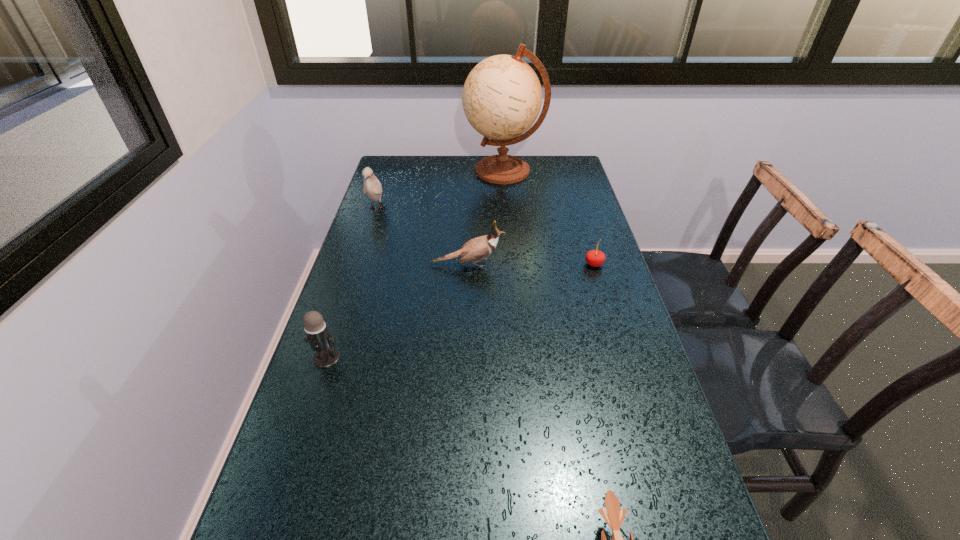
You are a GUI agent. You are given a task and a screenshot of the screen. Output one action in this format:
    pyautogui.click(x=<x>, y=<y>)
    Task: Click on the farthest object
    
    Given the screenshot: What is the action you would take?
    pyautogui.click(x=502, y=96)

Identify the location of the tallest object. point(502,96).

Where is `the leftmost bird`? The height and width of the screenshot is (540, 960). the leftmost bird is located at coordinates (372, 187).

You are a GUI agent. You are given a task and a screenshot of the screen. Output one action in this format:
    pyautogui.click(x=<x>, y=<y>)
    Task: Click on the second farthest object
    
    Given the screenshot: What is the action you would take?
    pyautogui.click(x=372, y=187)

The image size is (960, 540). Identify the location of the second bird from right to left. (478, 248).

This screenshot has width=960, height=540. I want to click on the fifth farthest object, so click(x=320, y=340).

At what (x,y) coordinates should I click in order to perform the action: click on cherry. Please return your answer as a coordinate pair (x, y). Looking at the image, I should click on (595, 258).

The width and height of the screenshot is (960, 540). I want to click on vacant region located on the surface of the globe, so click(408, 171).

Locate an element on the screen. The width and height of the screenshot is (960, 540). free space located 0.150m on the surface of the globe is located at coordinates (425, 171).

In order to click on vacant space situated 0.270m on the surface of the globe in this screenshot , I will do `click(396, 171)`.